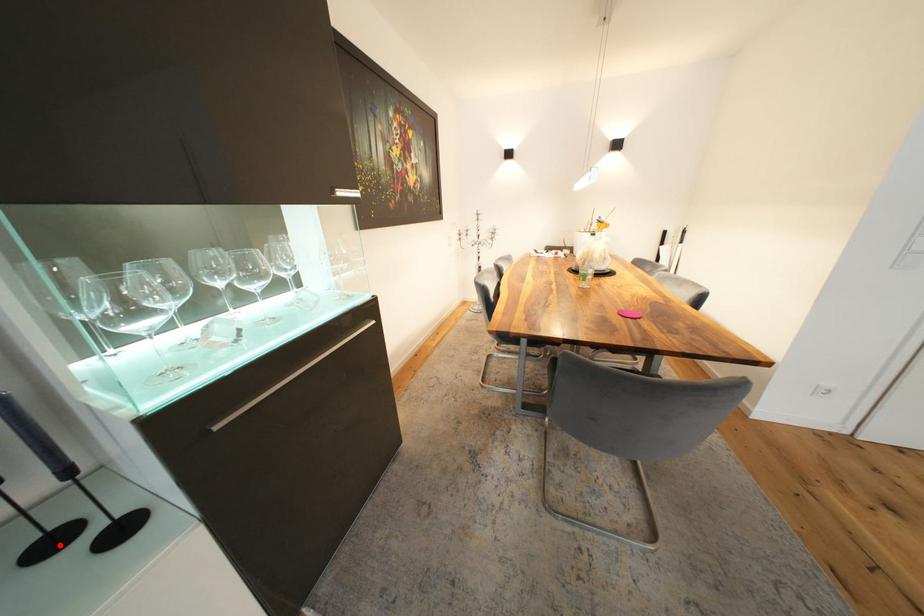
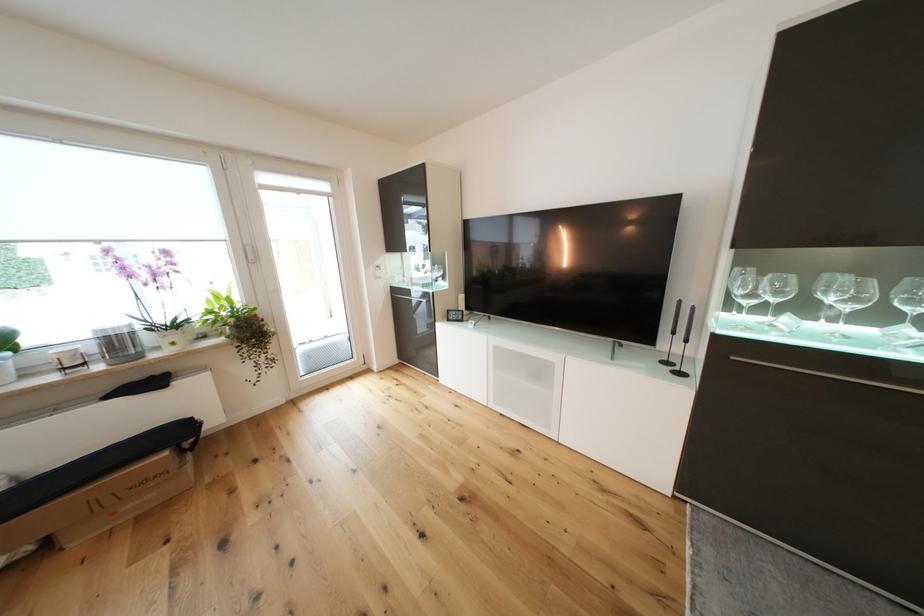
Question: I am providing you with two images of the same scene from different viewpoints. Given a red point in image1, look at the same physical point in image2. Is it:

Choices:
 (A) Closer to the viewpoint
 (B) Farther from the viewpoint

Answer: (A)